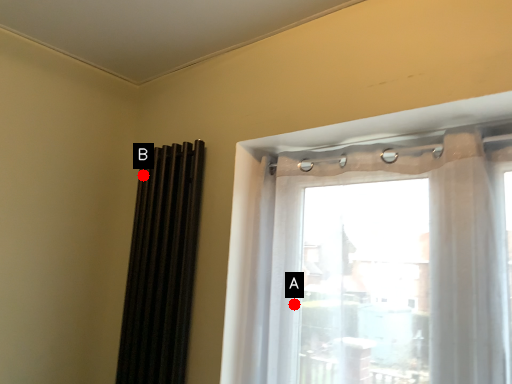
Question: Two points are circled on the image, labeled by A and B beside each circle. Among these points, which one is farthest from the camera?

Choices:
 (A) A is further
 (B) B is further

Answer: (B)